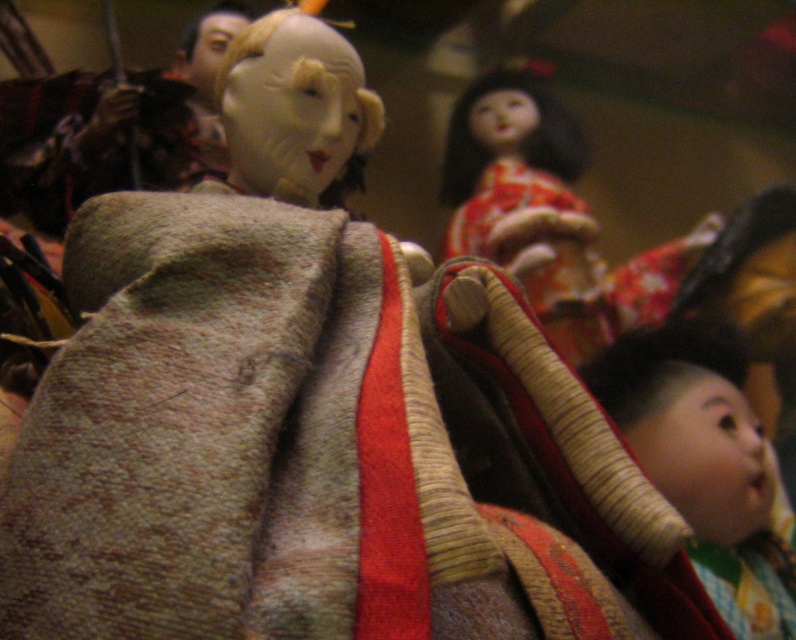
Looking at the traditional Japanese dolls display, you notice the smooth beige headband at lower right and the matte orange kimono at upper center. Which of these two items is positioned lower in the image?

The smooth beige headband at lower right is positioned lower in the image compared to the matte orange kimono at upper center because it has a lesser height.

Where is the smooth beige headband at lower right located in the image?

The smooth beige headband at lower right is located at point [704,461] in the image.

You are an art curator arranging a display. You need to ensure that the smooth beige headband at lower right is placed in a position that allows visitors to easily see both it and the matte orange kimono at upper center. Based on their current positions, which object is positioned higher in the image?

The matte orange kimono at upper center is positioned higher in the image than the smooth beige headband at lower right.